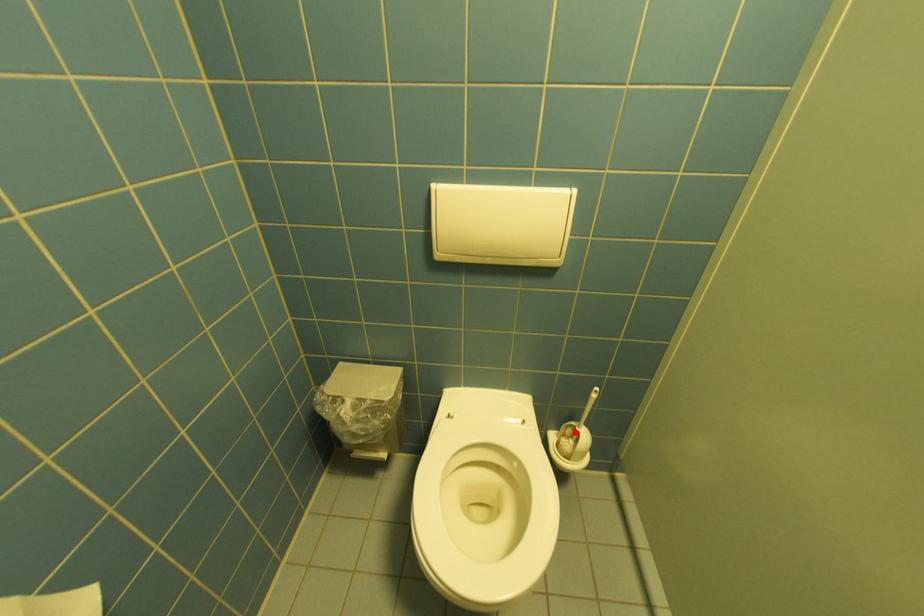
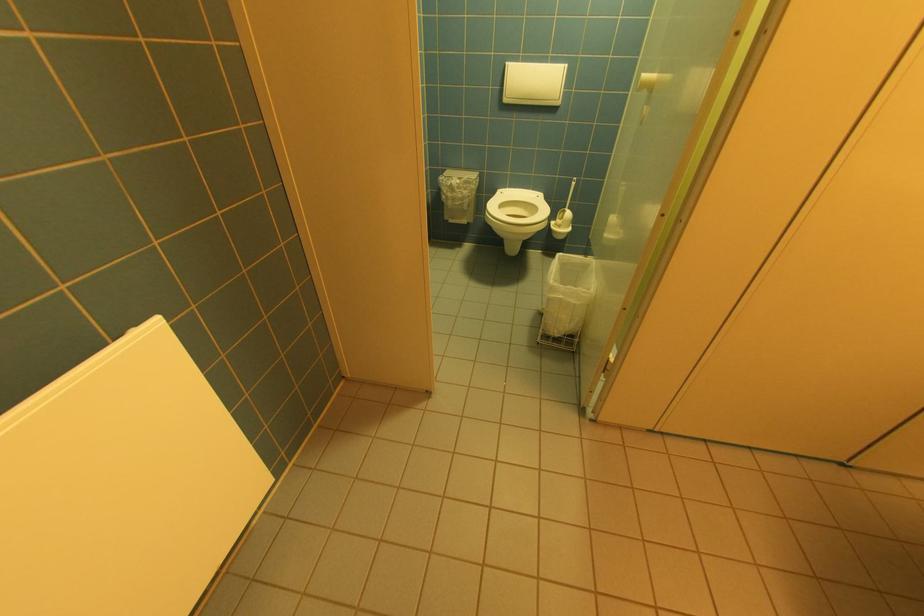
Find the pixel in the second image that matches the highlighted location in the first image.

(567, 215)